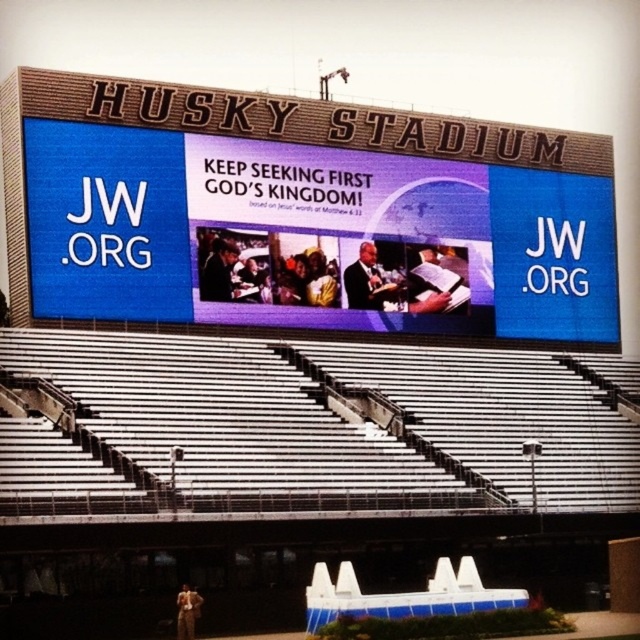
You are standing at the center of Husky Stadium and want to move from the point at coordinates point (38, 96) to the point at coordinates point (225, 275). According to the stadium layout, will you need to walk forward or backward to reach your destination?

Since point (38, 96) is in front of point (225, 275), you will need to walk backward to reach point (225, 275) from point (38, 96).

You are a photographer at Husky Stadium and need to capture a photo of both the metallic silver bleachers at lower center and the matte black suit at center. Since the bleachers are much taller than the suit, where should you position yourself to ensure both are visible in the frame?

To capture both the metallic silver bleachers at lower center and the matte black suit at center in the same frame, position yourself at a lower angle so that you can look up towards the bleachers while still including the matte black suit at center in the foreground. This way, the height difference between the two objects will be balanced within the shot.